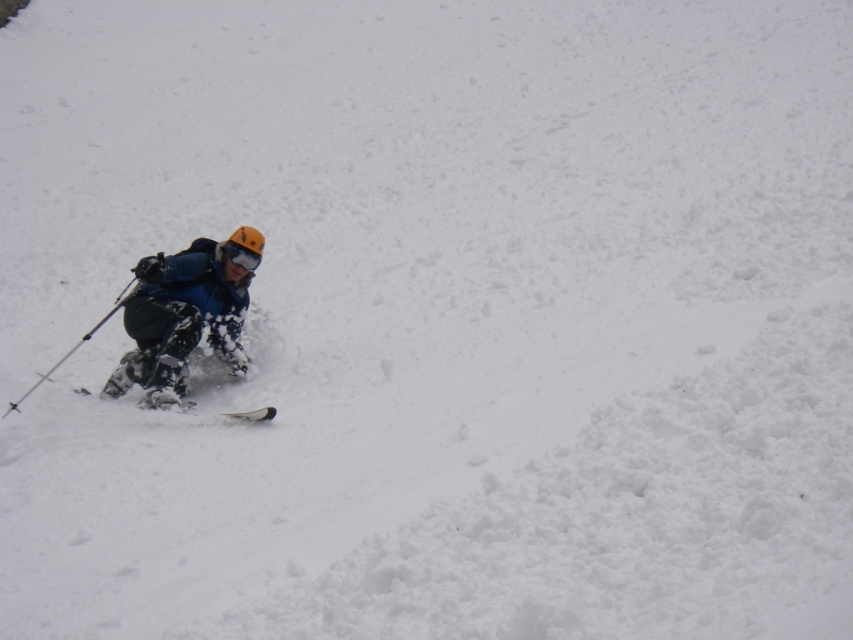
Between point (70, 353) and point (242, 412), which one is positioned in front?

Point (242, 412)

Is matte black ski pole at left further to camera compared to white matte ski at lower left?

Yes, matte black ski pole at left is behind white matte ski at lower left.

Based on the photo, who is more forward, (x=77, y=346) or (x=80, y=392)?

Point (x=80, y=392)

Where is `matte black ski pole at left`? matte black ski pole at left is located at coordinates (78, 342).

Who is more forward, [198,284] or [254,413]?

Point [254,413] is in front.

Is point (140, 339) more distant than point (271, 417)?

Yes, point (140, 339) is behind point (271, 417).

Is point (178, 301) positioned before point (260, 413)?

No, it is not.

Where is `matte blue ski suit at center-left`? matte blue ski suit at center-left is located at coordinates (184, 314).

The height and width of the screenshot is (640, 853). Find the location of `matte blue ski suit at center-left`. matte blue ski suit at center-left is located at coordinates coord(184,314).

Does point (178, 280) come farther from viewer compared to point (91, 333)?

Yes.

Where is `matte blue ski suit at center-left`? The image size is (853, 640). matte blue ski suit at center-left is located at coordinates (184, 314).